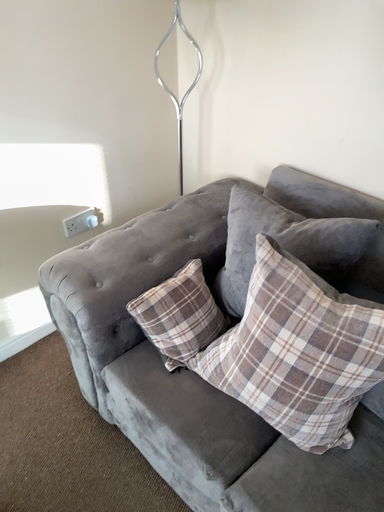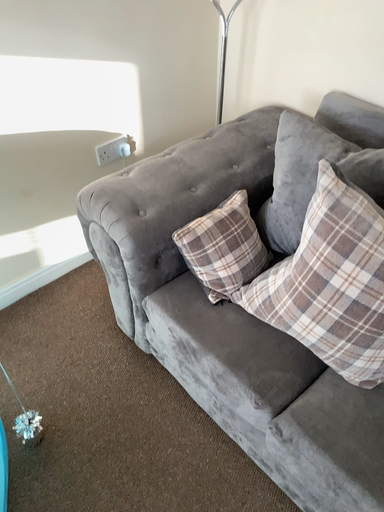
Question: How did the camera likely rotate when shooting the video?

Choices:
 (A) rotated downward
 (B) rotated upward

Answer: (A)